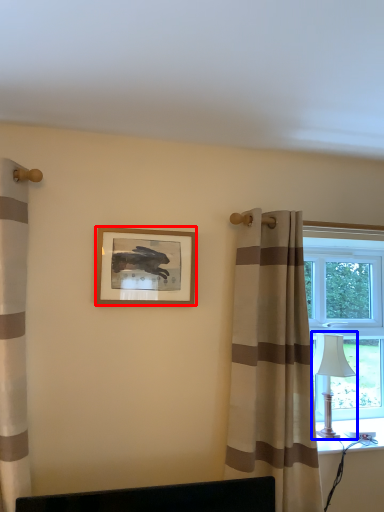
Question: Which of the following is the closest to the observer, picture frame (highlighted by a red box) or table lamp (highlighted by a blue box)?

Choices:
 (A) picture frame
 (B) table lamp

Answer: (A)